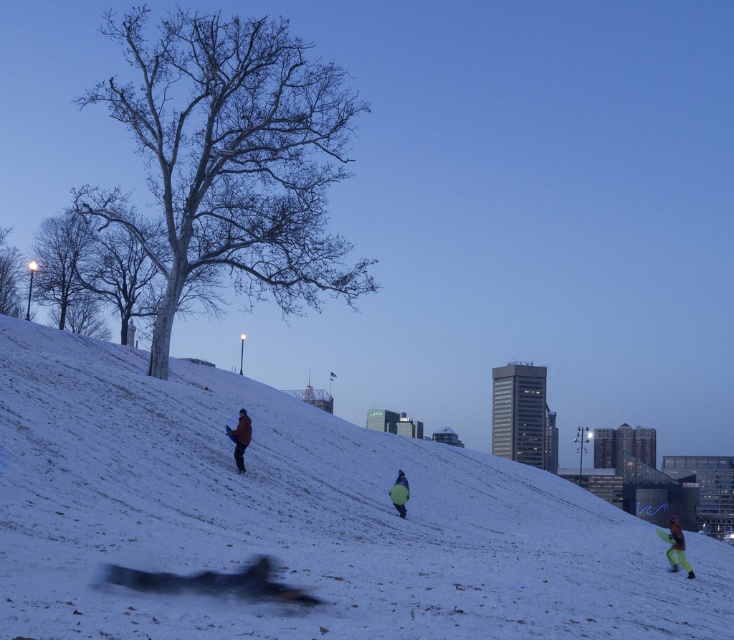
You are an artist sketching the winter scene and want to draw the smooth gray tree at upper left and smooth white tree at upper left. Which tree should you draw first if you want to follow the correct vertical order from bottom to top?

You should draw the smooth gray tree at upper left first because it is positioned below the smooth white tree at upper left in the scene.

From the picture: You are an observer looking at the winter scene. You see the white snow at center and the bare wood tree at left. Which object is positioned more to the east if the sun is setting in the west?

The bare wood tree at left is positioned more to the east because the white snow at center is to its right, and since the sun is setting in the west, the right side of the image faces east.